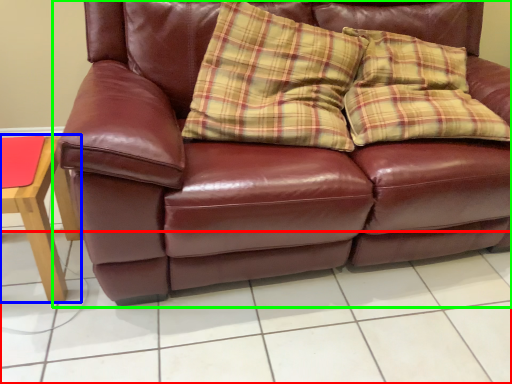
Question: Based on their relative distances, which object is nearer to tile (highlighted by a red box)? Choose from table (highlighted by a blue box) and studio couch (highlighted by a green box).

Choices:
 (A) table
 (B) studio couch

Answer: (B)